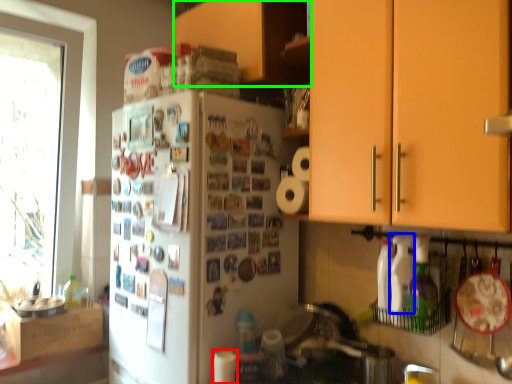
Question: Considering the real-world distances, which object is farthest from paper towel (highlighted by a red box)? bottle (highlighted by a blue box) or cabinetry (highlighted by a green box)?

Choices:
 (A) bottle
 (B) cabinetry

Answer: (B)